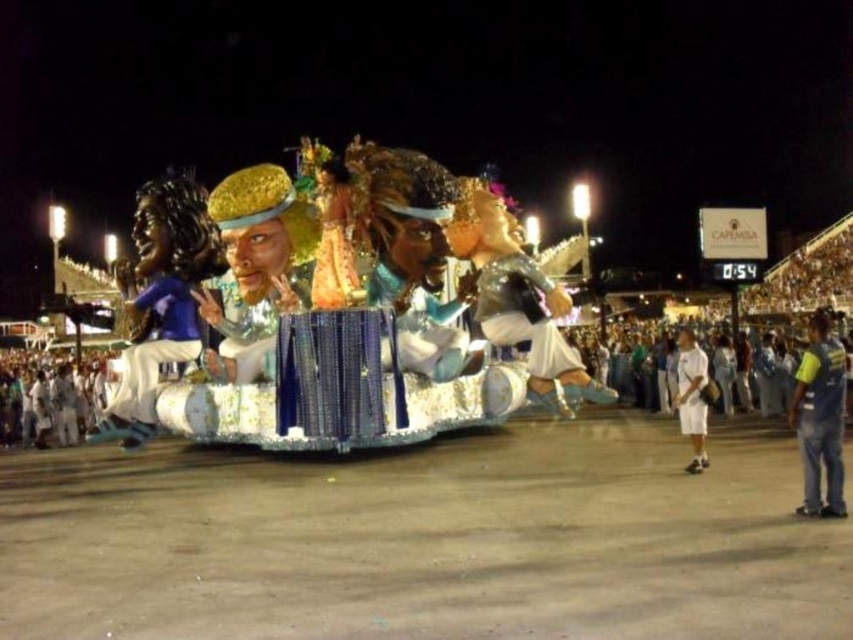
Question: Is shiny silver costume at center bigger than white fabric costume at lower right?

Choices:
 (A) yes
 (B) no

Answer: (B)

Question: Is matte blue fabric at left behind white fabric costume at lower right?

Choices:
 (A) yes
 (B) no

Answer: (A)

Question: Which is farther from the matte blue fabric at left?

Choices:
 (A) shiny silver costume at center
 (B) white fabric costume at lower right
 (C) shiny blue fabric at center
 (D) blue jeans at lower right

Answer: (D)

Question: Which object is positioned farthest from the blue jeans at lower right?

Choices:
 (A) shiny silver costume at center
 (B) shiny blue fabric at center

Answer: (B)

Question: Can you confirm if shiny blue fabric at center is smaller than white fabric costume at lower right?

Choices:
 (A) no
 (B) yes

Answer: (B)

Question: Which point is closer to the camera?

Choices:
 (A) shiny blue fabric at center
 (B) white fabric costume at lower right
 (C) blue jeans at lower right

Answer: (C)